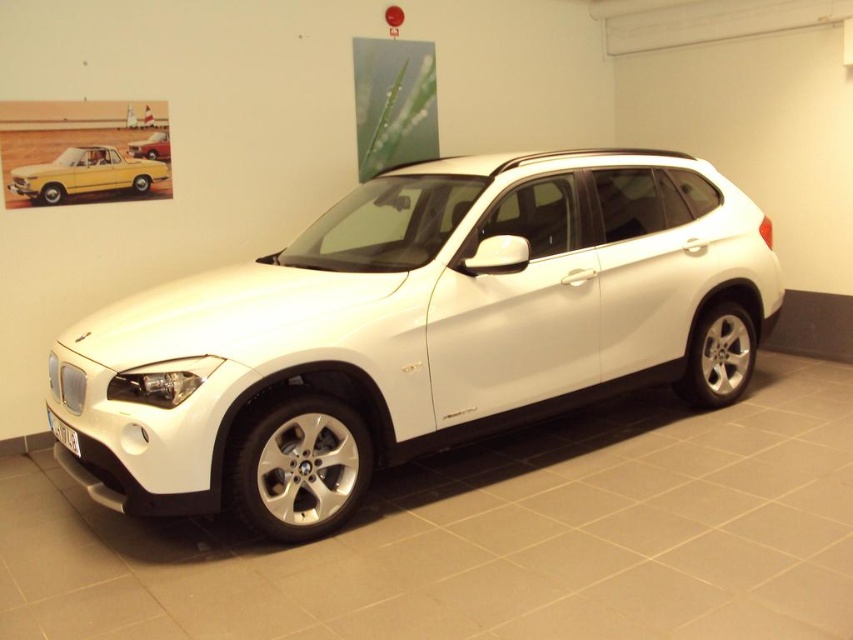
You are standing in a showroom and see the yellow matte vintage car at upper left and the matte black car at upper left. Which one is positioned lower on the wall?

The yellow matte vintage car at upper left is located below the matte black car at upper left, so it is positioned lower on the wall.

You are a photographer setting up a shoot in this garage. You want to ensure the white metallic car at center is the main focus and the matte black car at upper left is less visible. Based on their positions, is this arrangement possible?

Yes, because the white metallic car at center is in front of the matte black car at upper left, so positioning the camera to face the white metallic car at center would naturally obscure or reduce visibility of the matte black car at upper left behind it.

You are a delivery person trying to park a delivery van that is 2 meters wide in this garage. You see the white metallic car at center and the yellow matte vintage car at upper left. Can you safely park your van between them without touching either car?

The white metallic car at center is wider than the yellow matte vintage car at upper left. Since the van is 2 meters wide, you need to ensure there is enough space between the two cars. However, without knowing the exact distance between them, it is impossible to determine if the van will fit. Please check the actual space available before attempting to park.